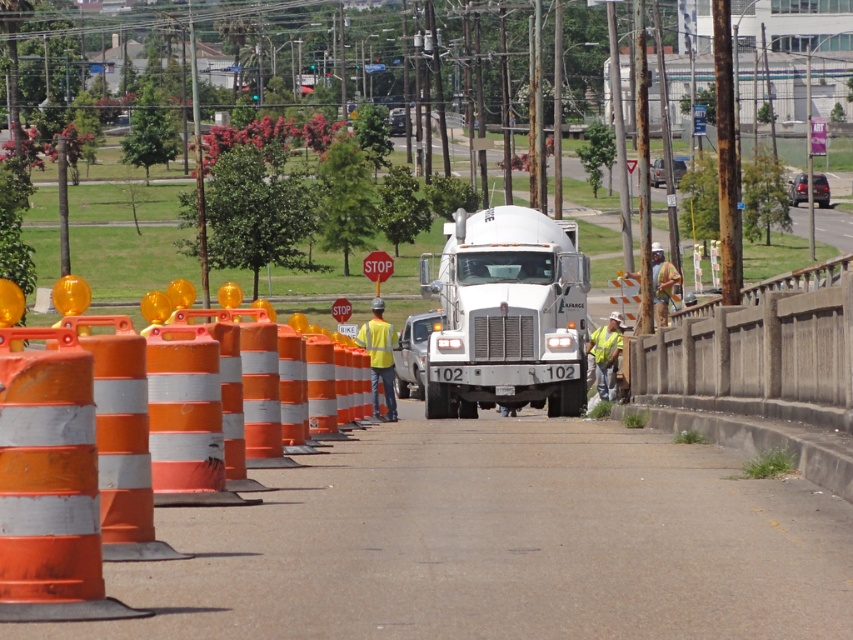
Which of these two, orange reflective cone at left or wooden fence at right, stands shorter?

orange reflective cone at left

Looking at this image, does orange reflective cone at left appear under wooden fence at right?

Yes, orange reflective cone at left is below wooden fence at right.

The height and width of the screenshot is (640, 853). In order to click on orange reflective cone at left in this screenshot , I will do `click(70, 470)`.

Does wooden fence at right appear on the right side of camouflage fabric construction worker at right?

Incorrect, wooden fence at right is not on the right side of camouflage fabric construction worker at right.

Looking at this image, who is more distant from viewer, (648, 381) or (666, 289)?

The point (666, 289) is more distant.

Which is in front, point (735, 369) or point (653, 266)?

Point (735, 369)

Locate an element on the screen. This screenshot has width=853, height=640. wooden fence at right is located at coordinates (758, 352).

Can you confirm if yellow reflective safety vest at center is positioned to the left of camouflage fabric construction worker at right?

Indeed, yellow reflective safety vest at center is positioned on the left side of camouflage fabric construction worker at right.

Who is shorter, yellow reflective safety vest at center or camouflage fabric construction worker at right?

yellow reflective safety vest at center

Between point (608, 342) and point (664, 291), which one is positioned in front?

Point (608, 342) is more forward.

This screenshot has height=640, width=853. What are the coordinates of `yellow reflective safety vest at center` in the screenshot? It's located at (606, 355).